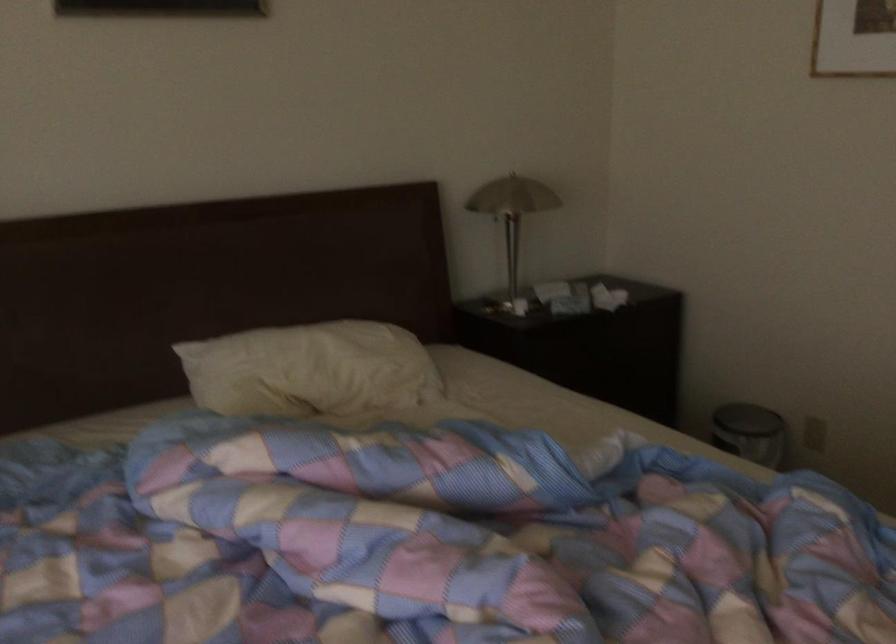
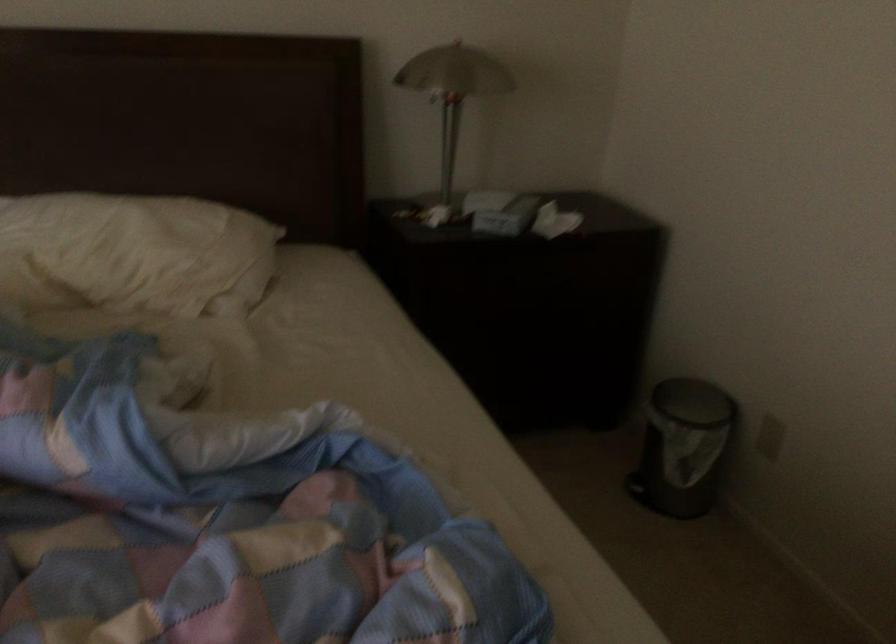
Where in the second image is the point corresponding to pixel 515 205 from the first image?

(453, 91)